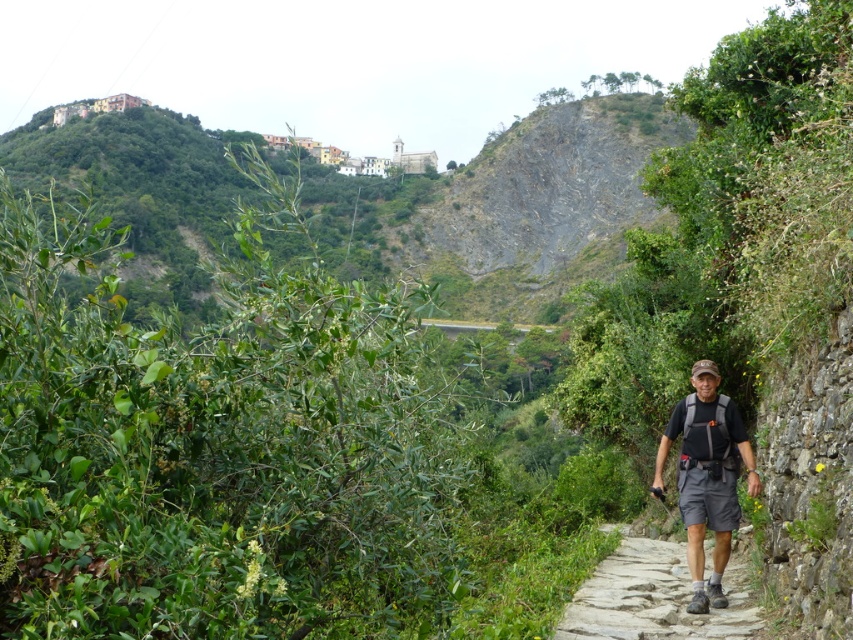
You are a hiker standing at the starting point of the gray stone path at center. You want to place your dark gray fabric backpack at center on the path so that it stays visible from where you are standing. Is the backpack currently positioned in a way that allows you to see it from your current position?

The gray stone path at center is closer to the viewer than dark gray fabric backpack at center. Therefore, if the backpack is placed behind the path, it might be obscured. However, since the backpack is on the path itself, which is closer, you should still be able to see it from your current position as long as there are no obstructions between you and the backpack.

You are a hiker who needs to place your dark gray fabric backpack at center on the gray stone path at center. Can you do this without moving more than 15 feet?

The gray stone path at center and dark gray fabric backpack at center are 16.99 feet apart from each other. Since the distance is more than 15 feet, you cannot place the dark gray fabric backpack at center on the gray stone path at center without moving more than 15 feet.

You are a hiker who wants to place your dark gray fabric backpack at center on the gray stone path at center. Based on their sizes, will the backpack fit entirely on the path?

The gray stone path at center is larger in size than the dark gray fabric backpack at center, so yes, the backpack can fit entirely on the path.